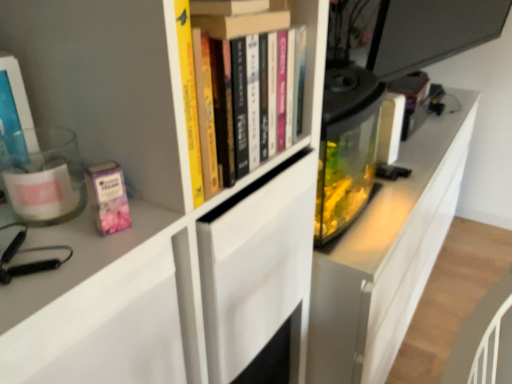
Question: Does pink matte paperback book at left have a greater width compared to hardcover books at upper center, the second book viewed from the left?

Choices:
 (A) no
 (B) yes

Answer: (A)

Question: Can you confirm if pink matte paperback book at left is positioned to the right of hardcover books at upper center, positioned as the 1th book in right-to-left order?

Choices:
 (A) yes
 (B) no

Answer: (B)

Question: From the image's perspective, is pink matte paperback book at left located beneath hardcover books at upper center, positioned as the 1th book in right-to-left order?

Choices:
 (A) no
 (B) yes

Answer: (B)

Question: Is hardcover books at upper center, the second book viewed from the left, at the back of pink matte paperback book at left?

Choices:
 (A) no
 (B) yes

Answer: (A)

Question: Is pink matte paperback book at left outside of hardcover books at upper center, the second book viewed from the left?

Choices:
 (A) no
 (B) yes

Answer: (B)

Question: Considering their positions, is hardcover books at upper center, positioned as the 1th book in right-to-left order, located in front of or behind translucent plastic container at left, acting as the 1th book starting from the left?

Choices:
 (A) front
 (B) behind

Answer: (B)

Question: Is hardcover books at upper center, positioned as the 1th book in right-to-left order, bigger or smaller than translucent plastic container at left, acting as the 1th book starting from the left?

Choices:
 (A) big
 (B) small

Answer: (A)

Question: Is hardcover books at upper center, positioned as the 1th book in right-to-left order, spatially inside translucent plastic container at left, acting as the 1th book starting from the left, or outside of it?

Choices:
 (A) outside
 (B) inside

Answer: (A)

Question: Would you say hardcover books at upper center, positioned as the 1th book in right-to-left order, is to the left or to the right of translucent plastic container at left, acting as the 1th book starting from the left, in the picture?

Choices:
 (A) right
 (B) left

Answer: (A)

Question: Visually, is hardcover books at upper center, positioned as the 1th book in right-to-left order, positioned to the left or to the right of pink matte paperback book at left?

Choices:
 (A) left
 (B) right

Answer: (B)

Question: In terms of width, does hardcover books at upper center, the second book viewed from the left, look wider or thinner when compared to pink matte paperback book at left?

Choices:
 (A) wide
 (B) thin

Answer: (A)

Question: Looking at the image, does hardcover books at upper center, the second book viewed from the left, seem bigger or smaller compared to pink matte paperback book at left?

Choices:
 (A) small
 (B) big

Answer: (B)

Question: From a real-world perspective, relative to pink matte paperback book at left, is hardcover books at upper center, positioned as the 1th book in right-to-left order, vertically above or below?

Choices:
 (A) below
 (B) above

Answer: (B)

Question: Considering the positions of pink matte paperback book at left and translucent plastic container at left, which is the second book from right to left, in the image, is pink matte paperback book at left wider or thinner than translucent plastic container at left, which is the second book from right to left,?

Choices:
 (A) wide
 (B) thin

Answer: (B)

Question: Relative to translucent plastic container at left, which is the second book from right to left, is pink matte paperback book at left in front or behind?

Choices:
 (A) behind
 (B) front

Answer: (A)